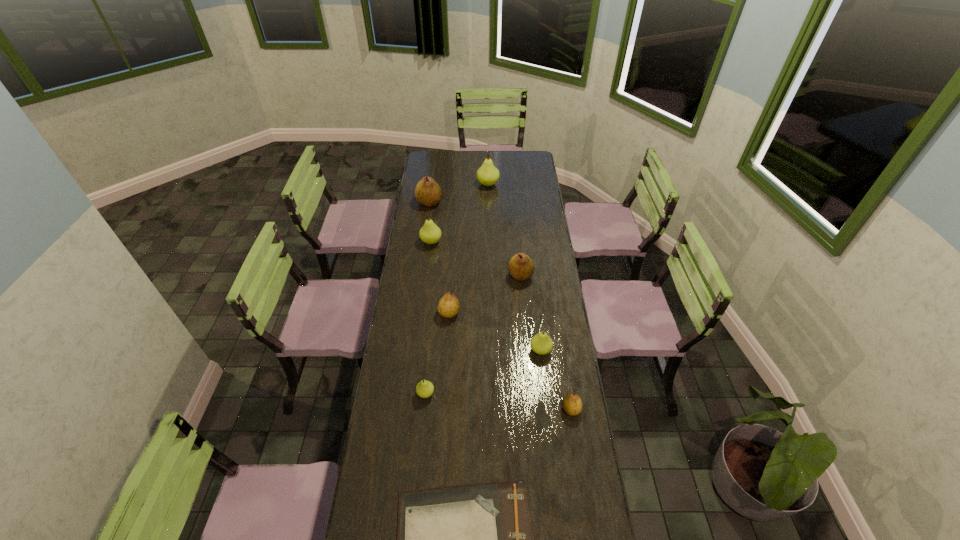
The width and height of the screenshot is (960, 540). I want to click on free space between the third biggest green pear and the sixth nearest object, so click(x=531, y=313).

This screenshot has width=960, height=540. Find the location of `free space between the rightmost brown pear and the third brown pear from right to left`. free space between the rightmost brown pear and the third brown pear from right to left is located at coordinates (510, 361).

Locate an element on the screen. The height and width of the screenshot is (540, 960). free point between the smallest green pear and the biggest green pear is located at coordinates (457, 289).

Locate an element on the screen. The width and height of the screenshot is (960, 540). vacant area that lies between the smallest green pear and the fourth farthest pear is located at coordinates (473, 335).

The image size is (960, 540). What are the coordinates of `free space between the biggest brown pear and the nearest green pear` in the screenshot? It's located at (427, 298).

Where is `empty space that is in between the third farthest object and the smallest green pear`? empty space that is in between the third farthest object and the smallest green pear is located at coordinates (428, 318).

Where is `object that ranks as the seventh closest to the sixth farthest pear`? object that ranks as the seventh closest to the sixth farthest pear is located at coordinates (427, 192).

Point out which object is positioned as the fifth nearest to the biggest brown pear. Please provide its 2D coordinates. Your answer should be formatted as a tuple, i.e. [(x, y)], where the tuple contains the x and y coordinates of a point satisfying the conditions above.

[(541, 343)]

Choose which pear is the seventh nearest neighbor to the second brown pear from right to left. Please provide its 2D coordinates. Your answer should be formatted as a tuple, i.e. [(x, y)], where the tuple contains the x and y coordinates of a point satisfying the conditions above.

[(487, 174)]

At what (x,y) coordinates should I click in order to perform the action: click on the second closest pear to the nearest green pear. Please return your answer as a coordinate pair (x, y). The height and width of the screenshot is (540, 960). Looking at the image, I should click on (541, 343).